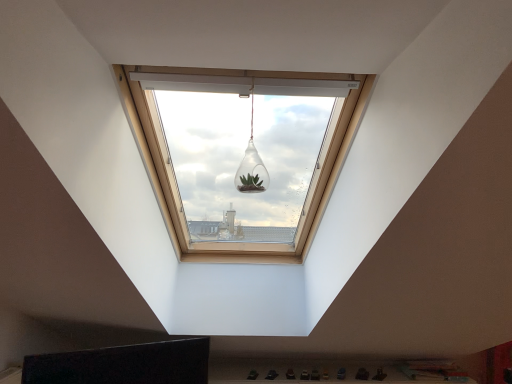
In order to click on transparent glass terrarium at center in this screenshot , I will do `click(251, 164)`.

Describe the element at coordinates (251, 164) in the screenshot. I see `transparent glass terrarium at center` at that location.

Where is `transparent glass terrarium at center`? The image size is (512, 384). transparent glass terrarium at center is located at coordinates (251, 164).